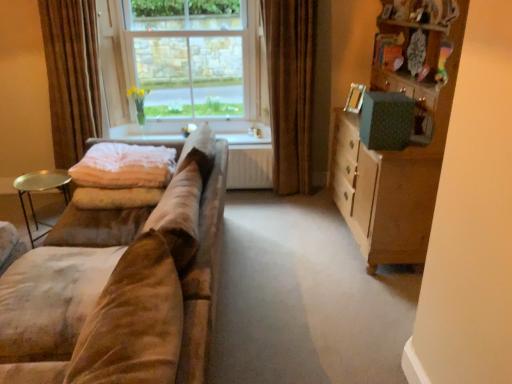
Find the location of a particular element. The width and height of the screenshot is (512, 384). free space to the left of wooden cabinet at right is located at coordinates (293, 248).